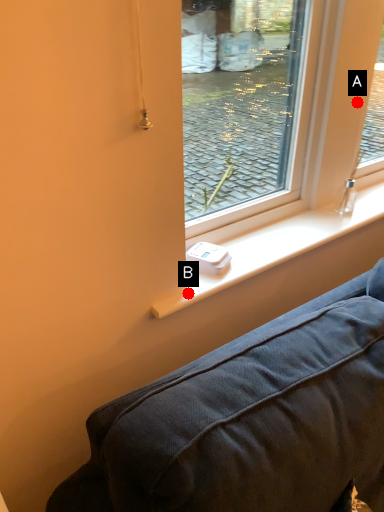
Question: Two points are circled on the image, labeled by A and B beside each circle. Which of the following is the closest to the observer?

Choices:
 (A) A is closer
 (B) B is closer

Answer: (B)